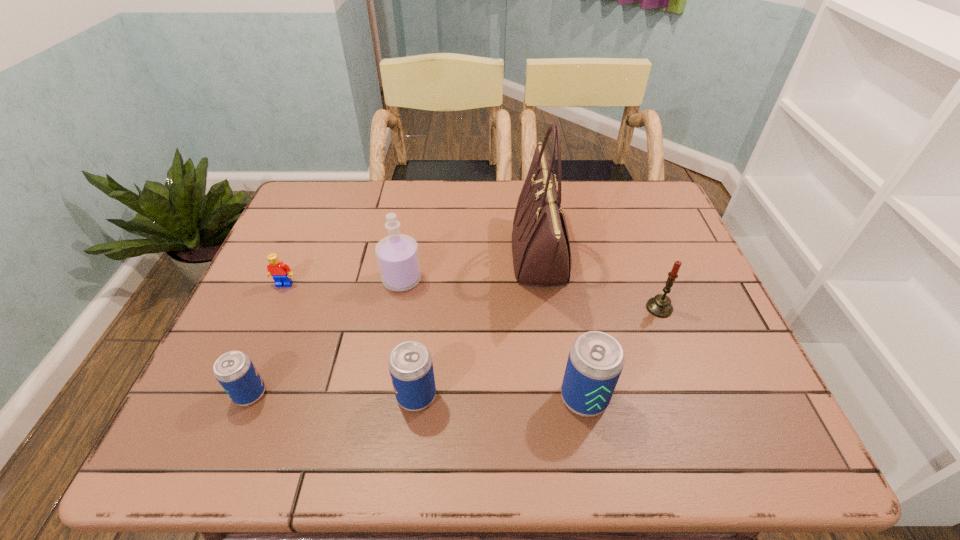
Locate an element on the screen. The width and height of the screenshot is (960, 540). free space located on the front-facing side of the tallest object is located at coordinates (391, 256).

Locate an element on the screen. The width and height of the screenshot is (960, 540). vacant area situated on the front-facing side of the tallest object is located at coordinates (442, 256).

Locate an element on the screen. The height and width of the screenshot is (540, 960). free space located 0.180m on the front-facing side of the tallest object is located at coordinates (445, 256).

I want to click on vacant space situated on the back of the rightmost object, so click(x=650, y=284).

The width and height of the screenshot is (960, 540). I want to click on vacant space situated 0.330m on the back of the second tallest object, so click(x=417, y=195).

I want to click on free region located on the front-facing side of the Lego, so click(x=264, y=332).

At what (x,y) coordinates should I click in order to perform the action: click on object at the far edge. Please return your answer as a coordinate pair (x, y). Looking at the image, I should click on (541, 252).

Locate an element on the screen. The image size is (960, 540). beer can that is at the left edge is located at coordinates (234, 370).

This screenshot has width=960, height=540. Find the location of `Lego at the left edge`. Lego at the left edge is located at coordinates (281, 273).

Locate an element on the screen. Image resolution: width=960 pixels, height=540 pixels. object at the right edge is located at coordinates (660, 306).